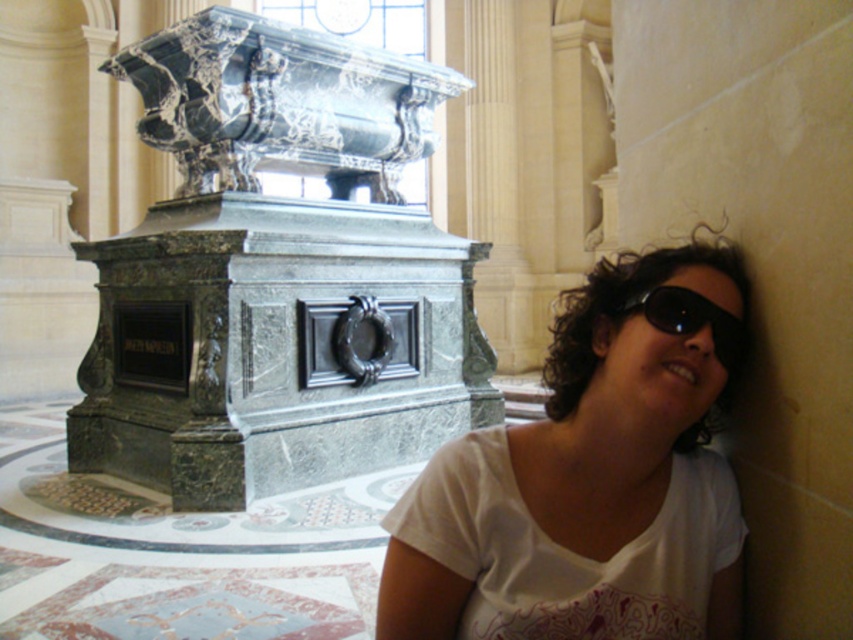
Which is more to the left, white cotton shirt at lower right or black plastic goggles at lower right?

white cotton shirt at lower right is more to the left.

Does white cotton shirt at lower right appear over black plastic goggles at lower right?

No.

Which is in front, point (717, 548) or point (708, 310)?

Point (708, 310) is more forward.

The image size is (853, 640). What are the coordinates of `white cotton shirt at lower right` in the screenshot? It's located at (590, 472).